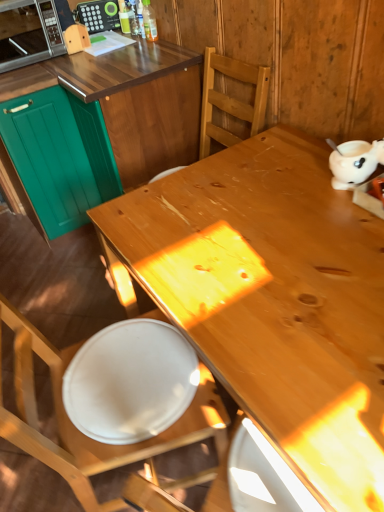
Question: Is natural wood desk at center next to wooden chair at center?

Choices:
 (A) no
 (B) yes

Answer: (A)

Question: Can you confirm if natural wood desk at center is bigger than wooden chair at center?

Choices:
 (A) no
 (B) yes

Answer: (B)

Question: Can you confirm if natural wood desk at center is positioned to the right of wooden chair at center?

Choices:
 (A) yes
 (B) no

Answer: (A)

Question: From a real-world perspective, is natural wood desk at center over wooden chair at center?

Choices:
 (A) yes
 (B) no

Answer: (B)

Question: Does natural wood desk at center have a lesser width compared to wooden chair at center?

Choices:
 (A) no
 (B) yes

Answer: (A)

Question: In terms of height, does matte black radio at upper left look taller or shorter compared to natural wood desk at center?

Choices:
 (A) short
 (B) tall

Answer: (A)

Question: In terms of size, does matte black radio at upper left appear bigger or smaller than natural wood desk at center?

Choices:
 (A) big
 (B) small

Answer: (B)

Question: Does point (77, 16) appear closer or farther from the camera than point (130, 247)?

Choices:
 (A) closer
 (B) farther

Answer: (B)

Question: Relative to natural wood desk at center, is matte black radio at upper left in front or behind?

Choices:
 (A) behind
 (B) front

Answer: (A)

Question: Would you say translucent plastic bottle at upper center is to the left or to the right of white glossy plate at lower left in the picture?

Choices:
 (A) right
 (B) left

Answer: (B)

Question: Is translucent plastic bottle at upper center in front of or behind white glossy plate at lower left in the image?

Choices:
 (A) behind
 (B) front

Answer: (A)

Question: Looking at the image, does translucent plastic bottle at upper center seem bigger or smaller compared to white glossy plate at lower left?

Choices:
 (A) big
 (B) small

Answer: (B)

Question: Does point (152, 13) appear closer or farther from the camera than point (71, 389)?

Choices:
 (A) closer
 (B) farther

Answer: (B)

Question: Is teal wood cabinetry at left, which is the 2th cabinetry in left-to-right order, in front of or behind natural wood desk at center in the image?

Choices:
 (A) front
 (B) behind

Answer: (B)

Question: Is point (175, 62) closer or farther from the camera than point (269, 176)?

Choices:
 (A) farther
 (B) closer

Answer: (A)